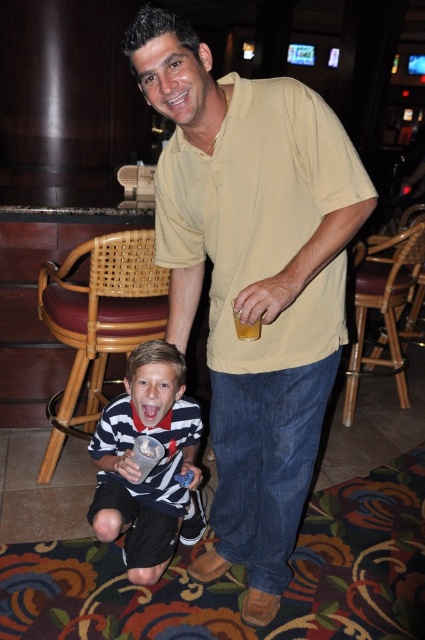
Can you confirm if yellow cotton shirt at center is positioned above translucent plastic cup at center?

No, yellow cotton shirt at center is not above translucent plastic cup at center.

Describe the element at coordinates (252, 280) in the screenshot. This screenshot has height=640, width=425. I see `yellow cotton shirt at center` at that location.

Is point (184, 202) more distant than point (238, 320)?

Yes, point (184, 202) is behind point (238, 320).

At what (x,y) coordinates should I click in order to perform the action: click on yellow cotton shirt at center. Please return your answer as a coordinate pair (x, y). This screenshot has height=640, width=425. Looking at the image, I should click on (252, 280).

Can you confirm if yellow cotton shirt at center is thinner than striped cotton shirt at lower left?

No.

Between point (158, 227) and point (155, 561), which one is positioned in front?

Point (158, 227) is in front.

Which is behind, point (289, 385) or point (195, 412)?

Point (195, 412)

Image resolution: width=425 pixels, height=640 pixels. Identify the location of yellow cotton shirt at center. (252, 280).

Who is more forward, [93,518] or [238,333]?

Point [238,333]

You are a GUI agent. You are given a task and a screenshot of the screen. Output one action in this format:
    pyautogui.click(x=<x>, y=<y>)
    Task: Click on the striped cotton shirt at lower left
    
    Given the screenshot: What is the action you would take?
    pyautogui.click(x=153, y=467)